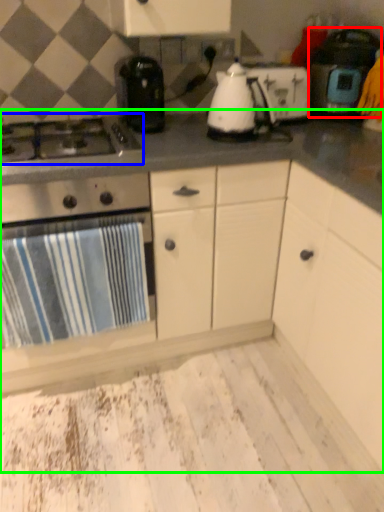
Question: Which object is the farthest from kitchen appliance (highlighted by a red box)? Choose among these: gas stove (highlighted by a blue box) or countertop (highlighted by a green box).

Choices:
 (A) gas stove
 (B) countertop

Answer: (A)